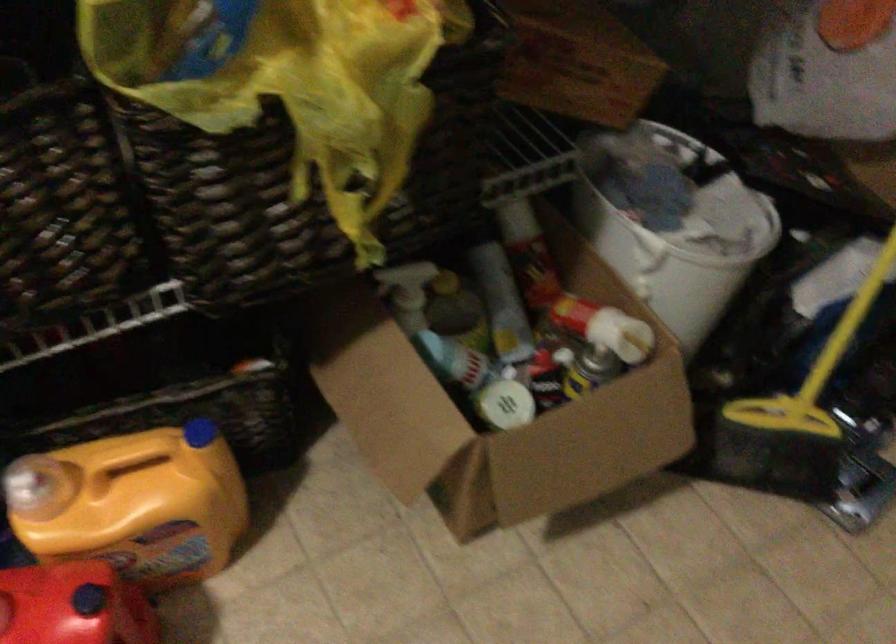
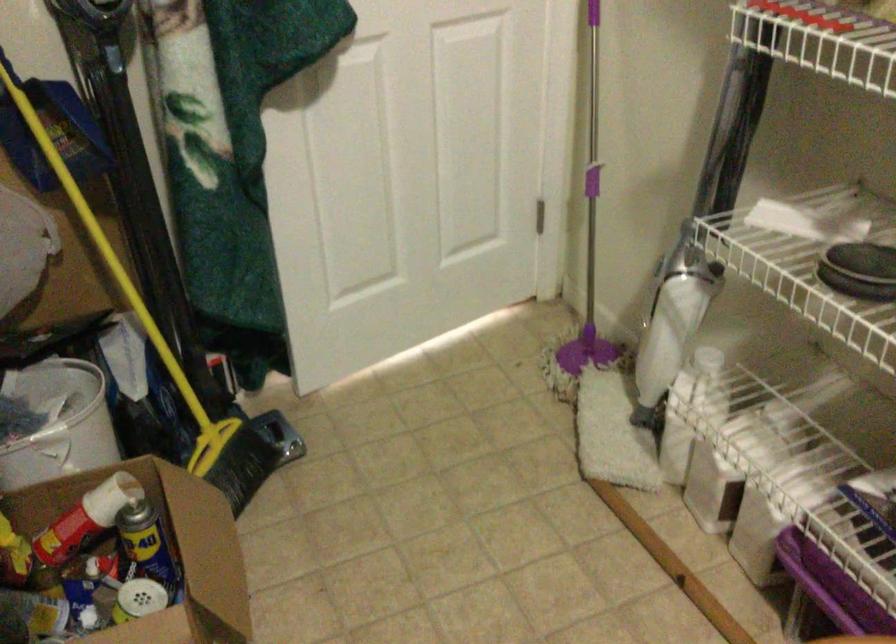
Find the pixel in the second image that matches (666,238) in the first image.

(58, 422)